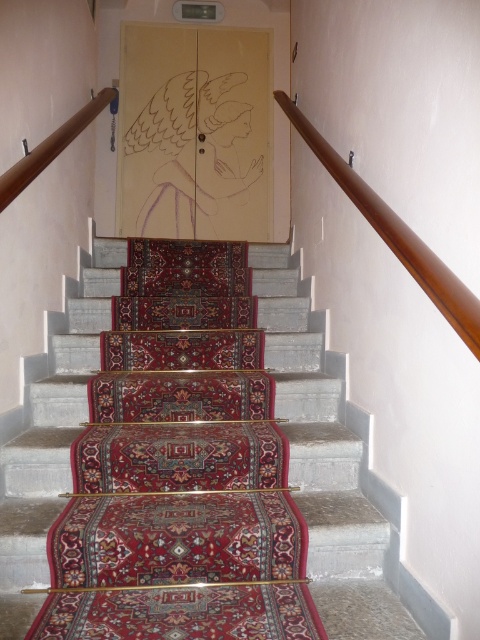
Question: Is wooden handrail at upper right below brown wooden handrail at upper left?

Choices:
 (A) no
 (B) yes

Answer: (B)

Question: From the image, what is the correct spatial relationship of wooden handrail at upper right in relation to brown wooden handrail at upper left?

Choices:
 (A) below
 (B) above

Answer: (A)

Question: Which point is farther to the camera?

Choices:
 (A) (469, 296)
 (B) (81, 125)

Answer: (B)

Question: Considering the relative positions of wooden handrail at upper right and brown wooden handrail at upper left in the image provided, where is wooden handrail at upper right located with respect to brown wooden handrail at upper left?

Choices:
 (A) below
 (B) above

Answer: (A)